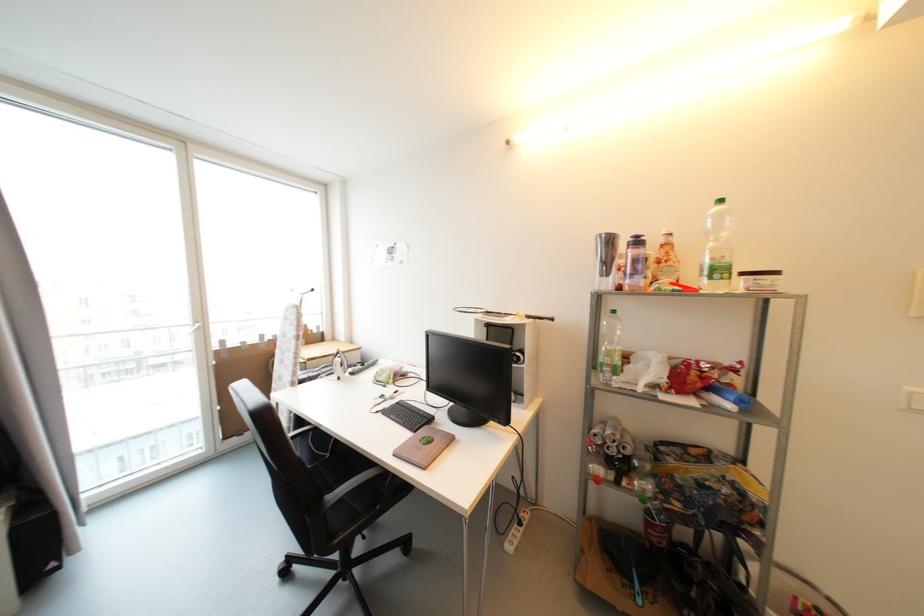
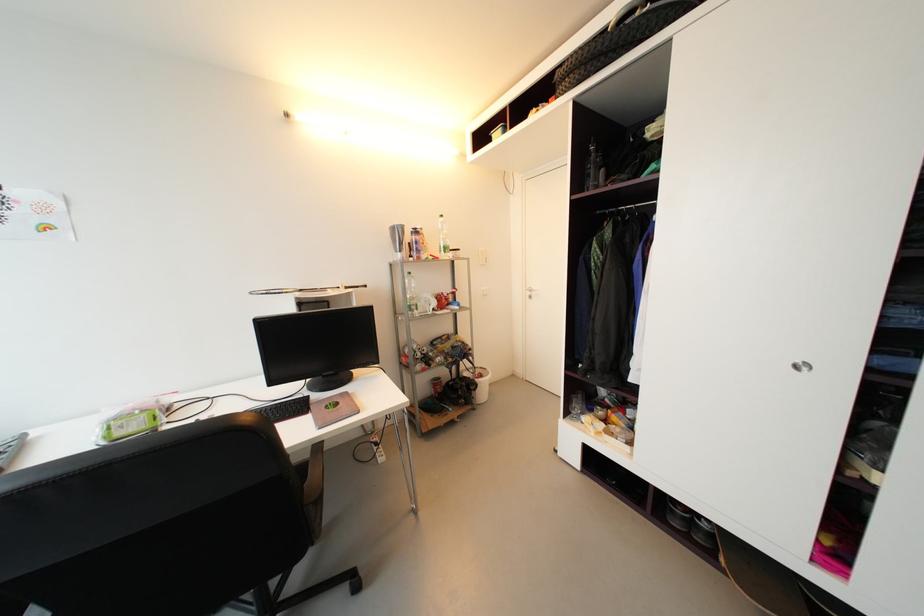
Locate, in the second image, the point that corresponds to pixel 606 367 in the first image.

(415, 308)